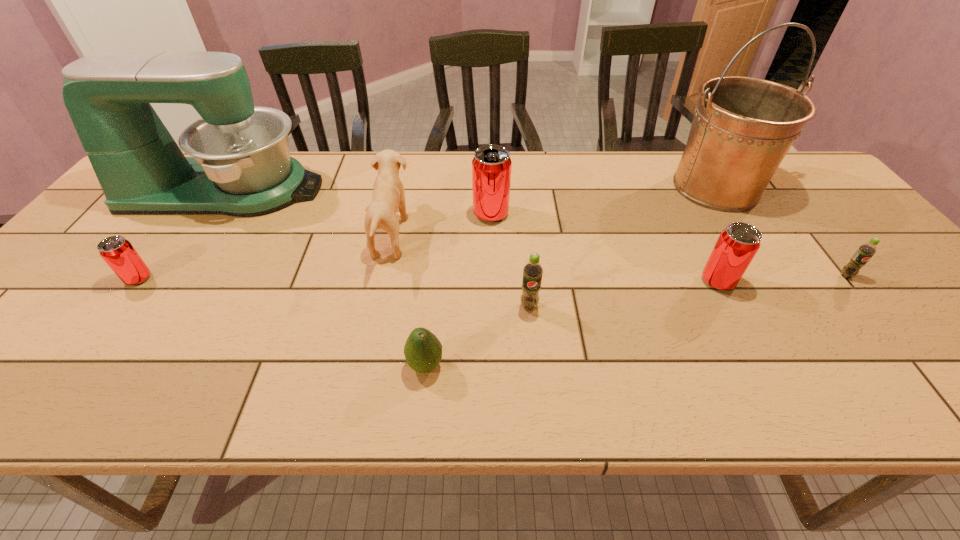
Find the location of `object that is at the far left corner`. object that is at the far left corner is located at coordinates (240, 166).

Find the location of `vacant space at the far edge`. vacant space at the far edge is located at coordinates (622, 188).

Where is `vacant space at the near edge of the desktop`? vacant space at the near edge of the desktop is located at coordinates (73, 389).

You are a GUI agent. You are given a task and a screenshot of the screen. Output one action in this format:
    pyautogui.click(x=<x>, y=<y>)
    Task: Click on the blank space at the left edge of the desktop
    This screenshot has width=960, height=540.
    Given the screenshot: What is the action you would take?
    pyautogui.click(x=60, y=352)

The image size is (960, 540). In the image, there is a desktop. What are the coordinates of `free space at the right edge` in the screenshot? It's located at (927, 326).

In the image, there is a desktop. Where is `vacant space at the near right corner`? This screenshot has height=540, width=960. vacant space at the near right corner is located at coordinates (941, 372).

Find the location of a particular element. free space between the farthest soda and the bucket is located at coordinates (603, 200).

Image resolution: width=960 pixels, height=540 pixels. Find the location of `empty location between the bucket and the leftmost soda`. empty location between the bucket and the leftmost soda is located at coordinates (427, 233).

Find the location of a particular element. Image resolution: width=960 pixels, height=540 pixels. unoccupied position between the fourth object from left to right and the eighth shortest object is located at coordinates (325, 278).

Where is `free spot between the eighth shortest object and the second biggest red soda can`? free spot between the eighth shortest object and the second biggest red soda can is located at coordinates (471, 235).